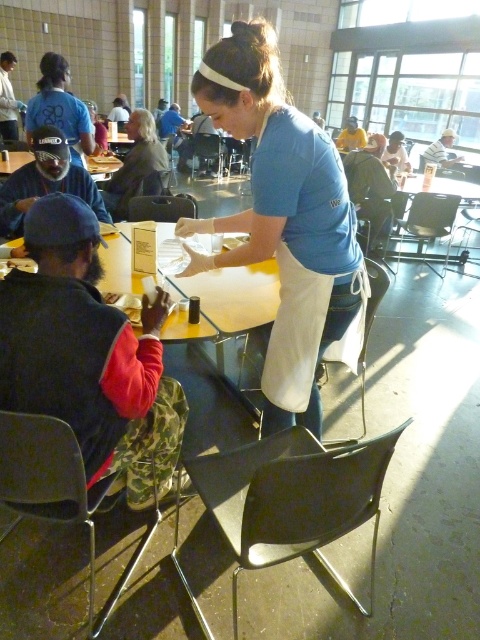
Can you confirm if matte blue shirt at upper left is smaller than matte blue shirt at center?

No, matte blue shirt at upper left is not smaller than matte blue shirt at center.

At what (x,y) coordinates should I click in order to perform the action: click on matte blue shirt at upper left. Please return your answer as a coordinate pair (x, y). This screenshot has width=480, height=640. Looking at the image, I should click on (60, 108).

I want to click on matte blue shirt at upper left, so click(60, 108).

Can you confirm if blue cotton shirt at center is bigger than matte blue shirt at center?

Yes.

Which is more to the right, blue cotton shirt at center or matte blue shirt at center?

blue cotton shirt at center is more to the right.

Is point (323, 314) in front of point (140, 129)?

Yes, point (323, 314) is closer to viewer.

You are a GUI agent. You are given a task and a screenshot of the screen. Output one action in this format:
    pyautogui.click(x=<x>, y=<y>)
    Task: Click on the blue cotton shirt at center
    
    Given the screenshot: What is the action you would take?
    pyautogui.click(x=283, y=220)

Between blue cotton shirt at center and matte blue shirt at upper left, which one appears on the left side from the viewer's perspective?

From the viewer's perspective, matte blue shirt at upper left appears more on the left side.

Does blue cotton shirt at center have a greater width compared to matte blue shirt at upper left?

Yes, blue cotton shirt at center is wider than matte blue shirt at upper left.

Is point (317, 332) behind point (45, 84)?

No.

The image size is (480, 640). In order to click on blue cotton shirt at center in this screenshot , I will do `click(283, 220)`.